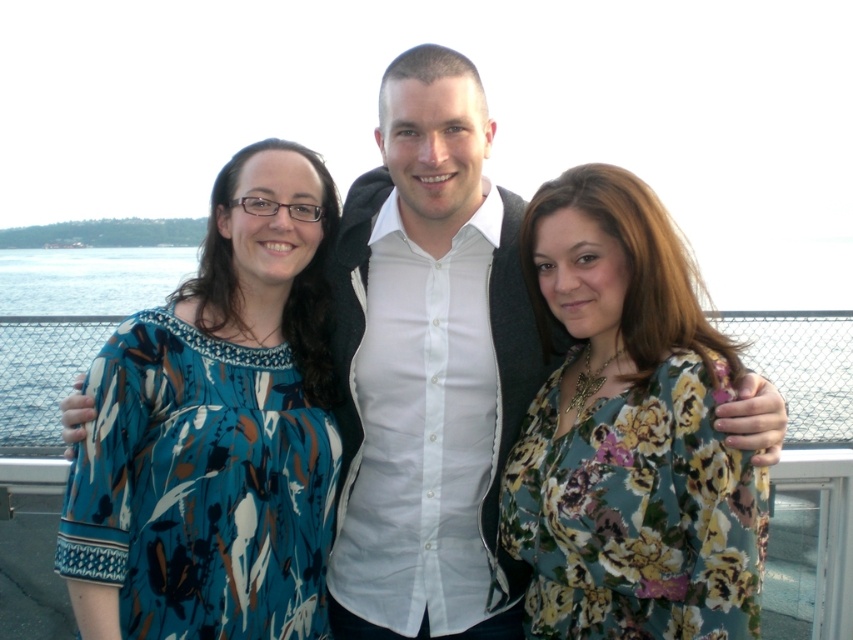
Question: Which point appears farthest from the camera in this image?

Choices:
 (A) (227, 230)
 (B) (437, 586)
 (C) (735, 515)

Answer: (A)

Question: From the image, what is the correct spatial relationship of white matte shirt at center in relation to floral print blouse at center?

Choices:
 (A) above
 (B) below

Answer: (A)

Question: Which object is positioned farthest from the white matte shirt at center?

Choices:
 (A) blue floral blouse at left
 (B) floral print blouse at center

Answer: (B)

Question: Is white matte shirt at center thinner than floral print blouse at center?

Choices:
 (A) no
 (B) yes

Answer: (A)

Question: Is blue floral blouse at left smaller than floral print blouse at center?

Choices:
 (A) yes
 (B) no

Answer: (B)

Question: Among these objects, which one is farthest from the camera?

Choices:
 (A) blue floral blouse at left
 (B) floral print blouse at center

Answer: (A)